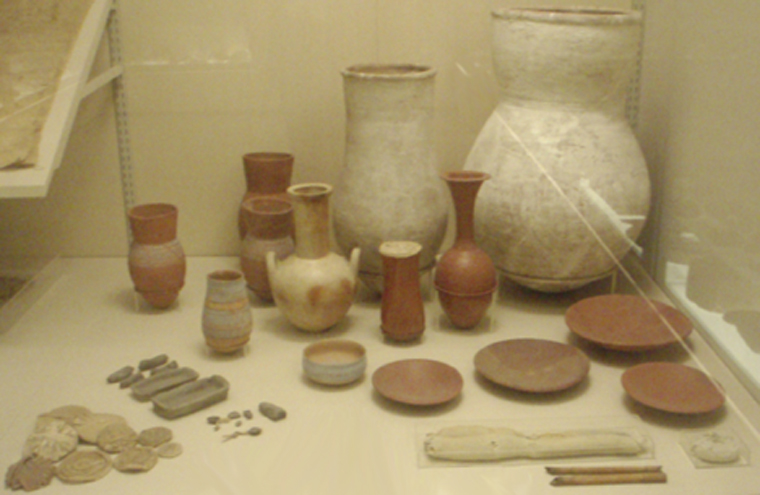
Where is `shelf`? shelf is located at coordinates (347, 439).